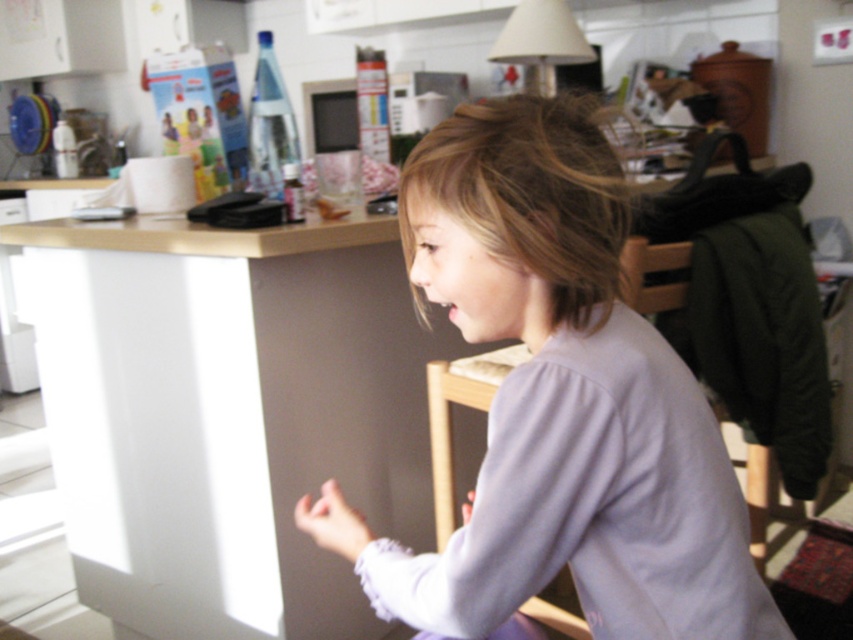
Question: Which object is closer to the camera taking this photo?

Choices:
 (A) blonde smooth hair at center
 (B) light purple fabric at center

Answer: (B)

Question: Where is light purple fabric at center located in relation to blonde smooth hair at center in the image?

Choices:
 (A) left
 (B) right

Answer: (A)

Question: Does light purple fabric at center appear on the right side of blonde smooth hair at center?

Choices:
 (A) no
 (B) yes

Answer: (A)

Question: Does light purple fabric at center appear under blonde smooth hair at center?

Choices:
 (A) no
 (B) yes

Answer: (B)

Question: Which of the following is the farthest from the observer?

Choices:
 (A) blonde smooth hair at center
 (B) light purple fabric at center

Answer: (A)